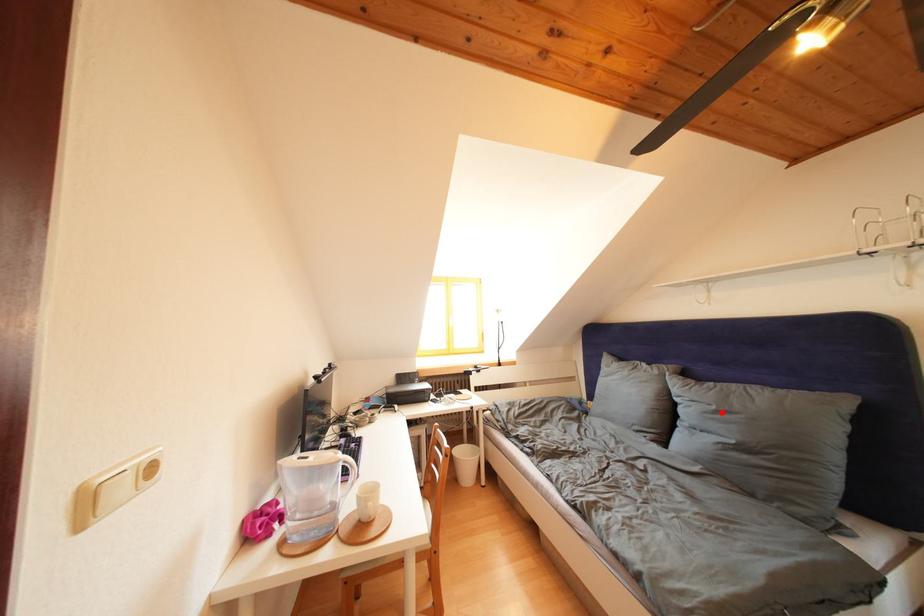
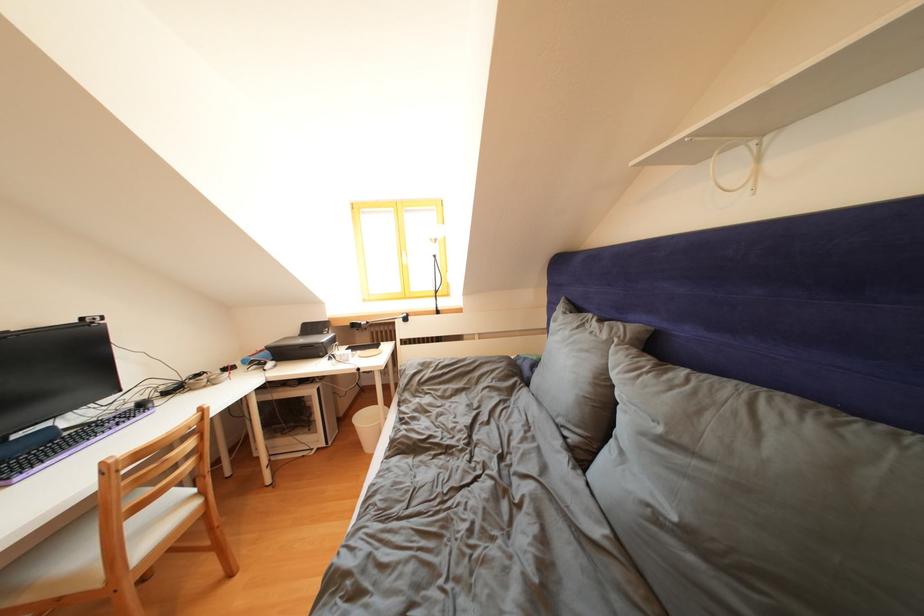
The point at the highlighted location is marked in the first image. Where is the corresponding point in the second image?

(667, 435)